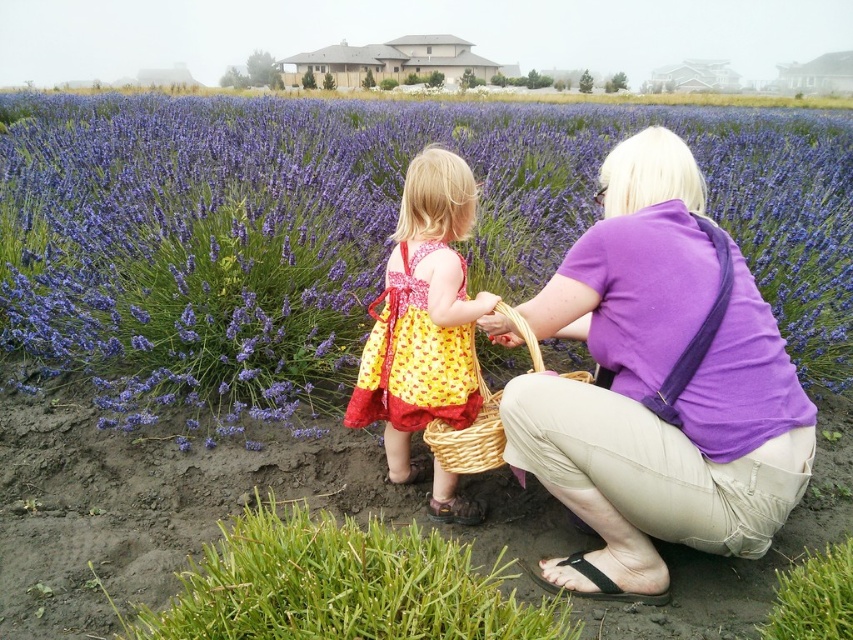
From the picture: Is purple soft lavender at center closer to camera compared to yellow dotted fabric dress at center?

No, purple soft lavender at center is behind yellow dotted fabric dress at center.

Does purple soft lavender at center appear under yellow dotted fabric dress at center?

No, purple soft lavender at center is not below yellow dotted fabric dress at center.

Who is more forward, (225, 141) or (401, 257)?

Point (401, 257)

The width and height of the screenshot is (853, 640). What are the coordinates of `purple soft lavender at center` in the screenshot? It's located at (350, 232).

Which is behind, point (630, 589) or point (474, 420)?

The point (474, 420) is more distant.

Between point (692, 195) and point (537, 348), which one is positioned behind?

Positioned behind is point (692, 195).

At what (x,y) coordinates should I click in order to perform the action: click on purple cotton shirt at center. Please return your answer as a coordinate pair (x, y). Image resolution: width=853 pixels, height=640 pixels. Looking at the image, I should click on (659, 387).

Between yellow printed dress at center and yellow dotted fabric dress at center, which one has less height?

With less height is yellow dotted fabric dress at center.

Does point (439, 388) come behind point (460, 420)?

No.

Identify the location of yellow printed dress at center. (422, 316).